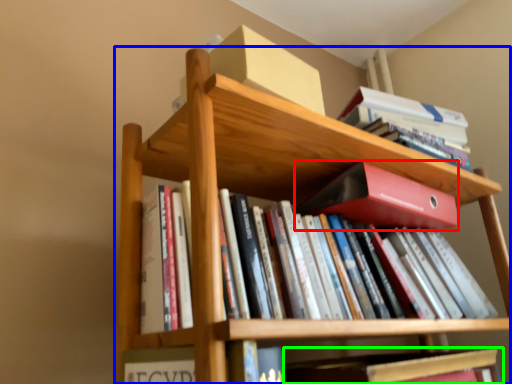
Question: Which is farther away from paperback book (highlighted by a red box)? bookcase (highlighted by a blue box) or book (highlighted by a green box)?

Choices:
 (A) bookcase
 (B) book

Answer: (B)